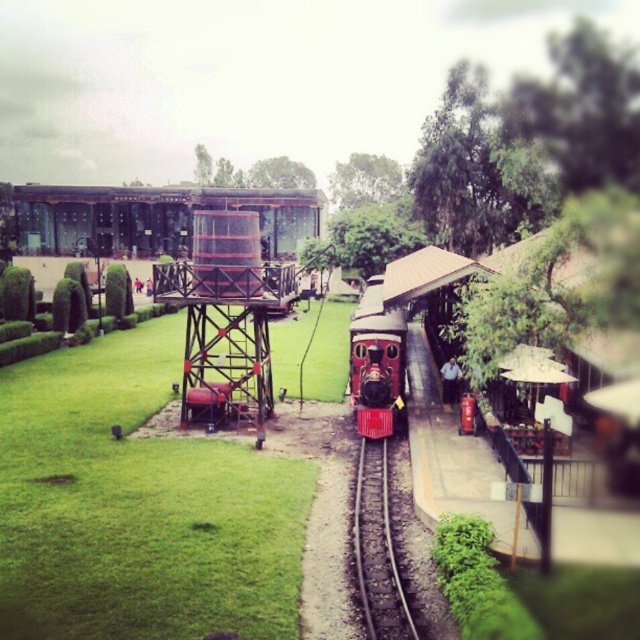
You are a miniature train engineer who wants to ensure the shiny red locomotive at center can safely pass over the black metal train track at center. Based on the scene description, is the track wide enough for the locomotive?

The black metal train track at center is thinner than the shiny red locomotive at center, so the track may not be wide enough to safely accommodate the locomotive. The engineer should verify the track specifications before proceeding.

You are a miniature train engineer standing at the station. You need to check the shiny red locomotive at center and the black metal train track at center. Which object is closer to you?

The black metal train track at center is closer to the viewer than the shiny red locomotive at center, so the black metal train track at center is closer to you.

You are a maintenance worker inspecting the miniature railway. You need to determine if the black metal train track at center can support the weight of the shiny red locomotive at center based on their heights. What should you consider?

The black metal train track at center has a lesser height compared to the shiny red locomotive at center. Since the track is shorter in height, it may not provide sufficient vertical clearance for the locomotive, potentially causing operational issues. Check if the track design accommodates the locomotive dimensions safely.